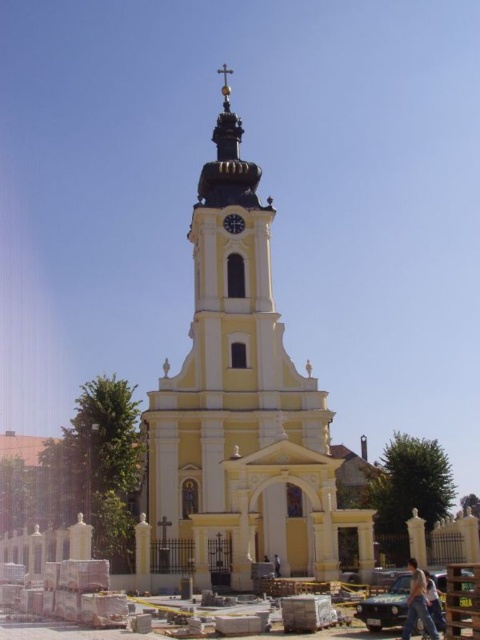
Who is shorter, yellow matte tower at center or metallic clock at upper center?

metallic clock at upper center

Consider the image. Does yellow matte tower at center appear on the left side of metallic clock at upper center?

Indeed, yellow matte tower at center is positioned on the left side of metallic clock at upper center.

Between point (250, 228) and point (238, 218), which one is positioned behind?

Positioned behind is point (238, 218).

Where is `yellow matte tower at center`? The image size is (480, 640). yellow matte tower at center is located at coordinates (242, 404).

In the scene shown: Who is taller, metallic clock at upper center or brown leather bag at center?

metallic clock at upper center

Is metallic clock at upper center further to the viewer compared to brown leather bag at center?

That is True.

Find the location of a particular element. Image resolution: width=480 pixels, height=640 pixels. metallic clock at upper center is located at coordinates (233, 224).

Where is `metallic clock at upper center`? This screenshot has height=640, width=480. metallic clock at upper center is located at coordinates (233, 224).

Can you confirm if jeans at lower right is positioned to the right of brown leather bag at center?

Yes, jeans at lower right is to the right of brown leather bag at center.

Who is more forward, (x=418, y=593) or (x=277, y=572)?

Point (x=418, y=593) is more forward.

Measure the distance between point (420, 579) and camera.

The distance of point (420, 579) from camera is 75.23 meters.

This screenshot has width=480, height=640. I want to click on jeans at lower right, so click(418, 604).